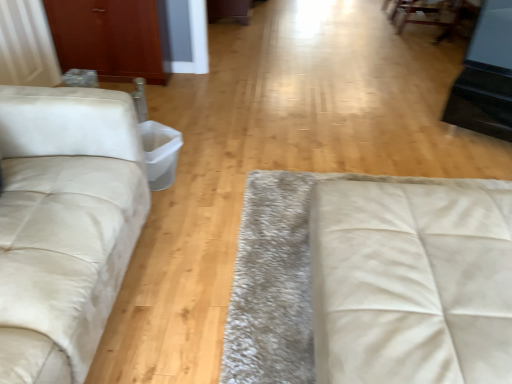
Question: Is suede-like beige studio couch at left, the second studio couch viewed from the right, wider or thinner than white leather studio couch at center, placed as the first studio couch when sorted from right to left?

Choices:
 (A) thin
 (B) wide

Answer: (A)

Question: From the image's perspective, is suede-like beige studio couch at left, the second studio couch viewed from the right, located above or below white leather studio couch at center, placed as the first studio couch when sorted from right to left?

Choices:
 (A) below
 (B) above

Answer: (B)

Question: Which is nearer to the suede-like beige studio couch at left, the second studio couch viewed from the right?

Choices:
 (A) matte wood armoire at upper left
 (B) white leather studio couch at center, placed as the first studio couch when sorted from right to left

Answer: (B)

Question: Which is nearer to the white leather studio couch at center, acting as the second studio couch starting from the left?

Choices:
 (A) suede-like beige studio couch at left, the second studio couch viewed from the right
 (B) matte wood armoire at upper left

Answer: (A)